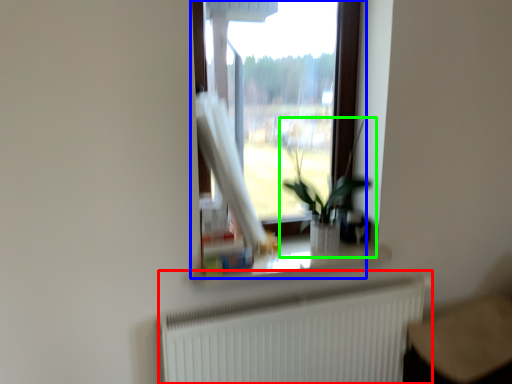
Question: Estimate the real-world distances between objects in this image. Which object is farther from radiator (highlighted by a red box), window (highlighted by a blue box) or houseplant (highlighted by a green box)?

Choices:
 (A) window
 (B) houseplant

Answer: (A)